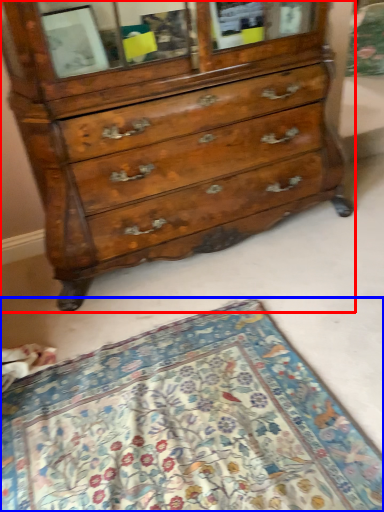
Question: Which object appears closest to the camera in this image, chest of drawers (highlighted by a red box) or mat (highlighted by a blue box)?

Choices:
 (A) chest of drawers
 (B) mat

Answer: (B)